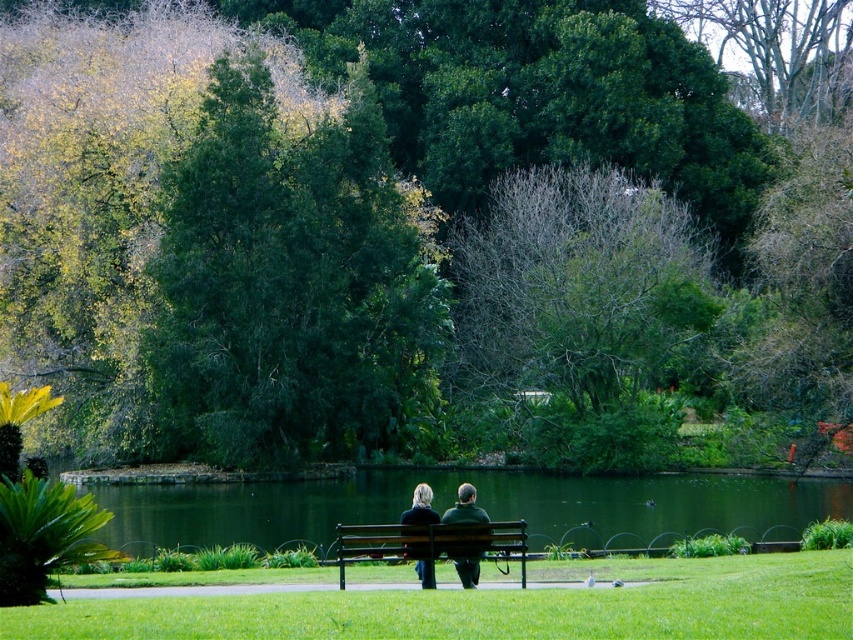
Question: Which point appears closest to the camera in this image?

Choices:
 (A) (317, 317)
 (B) (415, 493)
 (C) (469, 547)
 (D) (56, 308)

Answer: (C)

Question: Which of the following is the closest to the observer?

Choices:
 (A) (453, 509)
 (B) (636, 538)

Answer: (A)

Question: Does green leafy tree at center appear under green leafy tree at upper center?

Choices:
 (A) no
 (B) yes

Answer: (A)

Question: Does green leafy tree at upper center appear on the left side of dark green leather bench at center?

Choices:
 (A) no
 (B) yes

Answer: (B)

Question: Which of the following is the farthest from the observer?

Choices:
 (A) dark green leather bench at center
 (B) wooden bench at center
 (C) green leafy tree at center

Answer: (C)

Question: Is green leafy tree at center thinner than blonde hair at center?

Choices:
 (A) yes
 (B) no

Answer: (B)